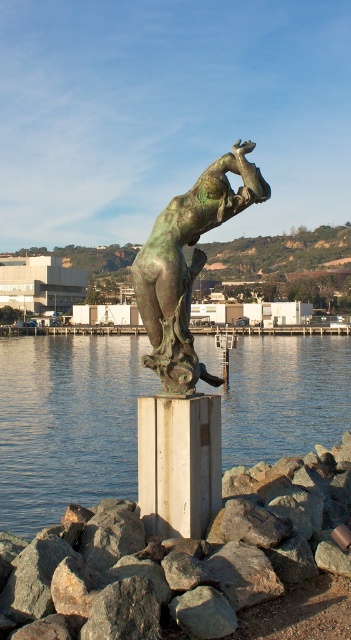
Question: Can you confirm if green patina water at center is thinner than bronze statue at center?

Choices:
 (A) yes
 (B) no

Answer: (B)

Question: Which of the following is the closest to the observer?

Choices:
 (A) (207, 189)
 (B) (108, 368)
 (C) (202, 486)
 (D) (303, 566)

Answer: (D)

Question: Based on their relative distances, which object is farther from the green patina water at center?

Choices:
 (A) bronze statue at center
 (B) white wood pillar at center
 (C) smooth concrete dock at center

Answer: (A)

Question: Which object appears farthest from the camera in this image?

Choices:
 (A) bronze statue at center
 (B) gray rock at lower center
 (C) white wood pillar at center

Answer: (A)

Question: Does gray rock at lower center appear over green patina water at center?

Choices:
 (A) yes
 (B) no

Answer: (B)

Question: Is gray rock at lower center above smooth concrete dock at center?

Choices:
 (A) yes
 (B) no

Answer: (B)